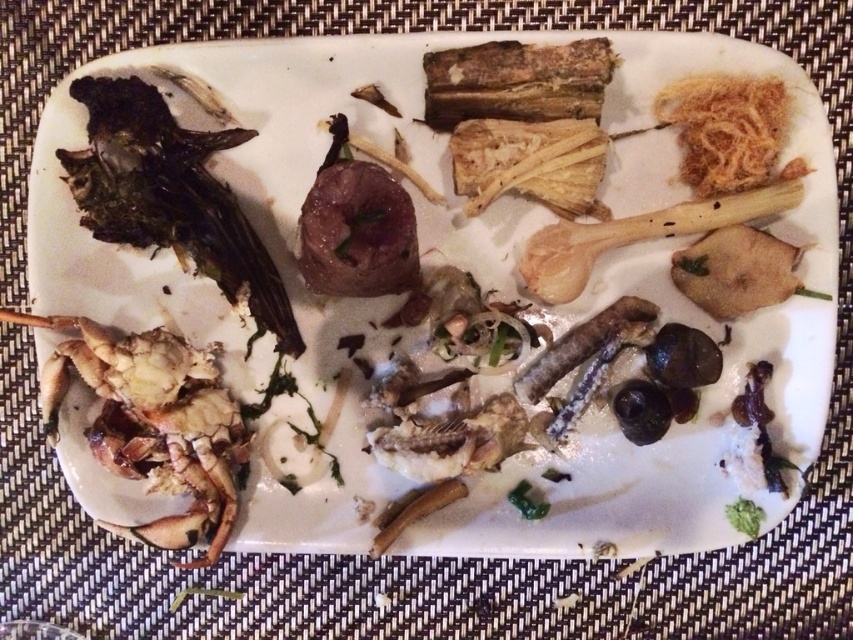
Does charcoal black seaweed at left have a greater height compared to golden crispy noodles at upper right?

Correct, charcoal black seaweed at left is much taller as golden crispy noodles at upper right.

Which is in front, point (212, 182) or point (679, 173)?

Positioned in front is point (679, 173).

Locate an element on the screen. charcoal black seaweed at left is located at coordinates coord(171,195).